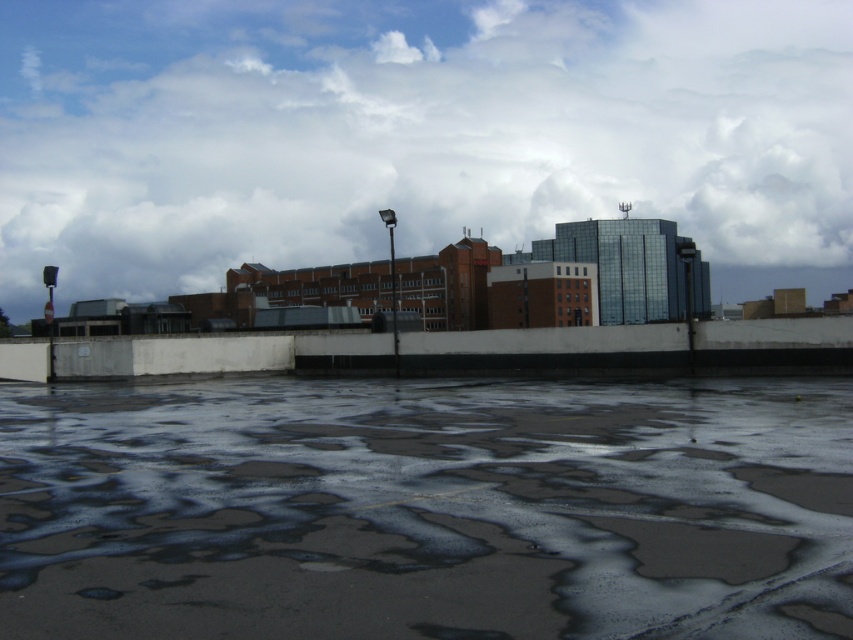
Is white fluffy cloud at upper center positioned in front of dark concrete flood at lower center?

No, it is not.

Is white fluffy cloud at upper center shorter than dark concrete flood at lower center?

Incorrect, white fluffy cloud at upper center's height does not fall short of dark concrete flood at lower center's.

Is point (154, 125) closer to camera compared to point (164, 632)?

No, it is behind (164, 632).

Identify the location of white fluffy cloud at upper center. Image resolution: width=853 pixels, height=640 pixels. (415, 134).